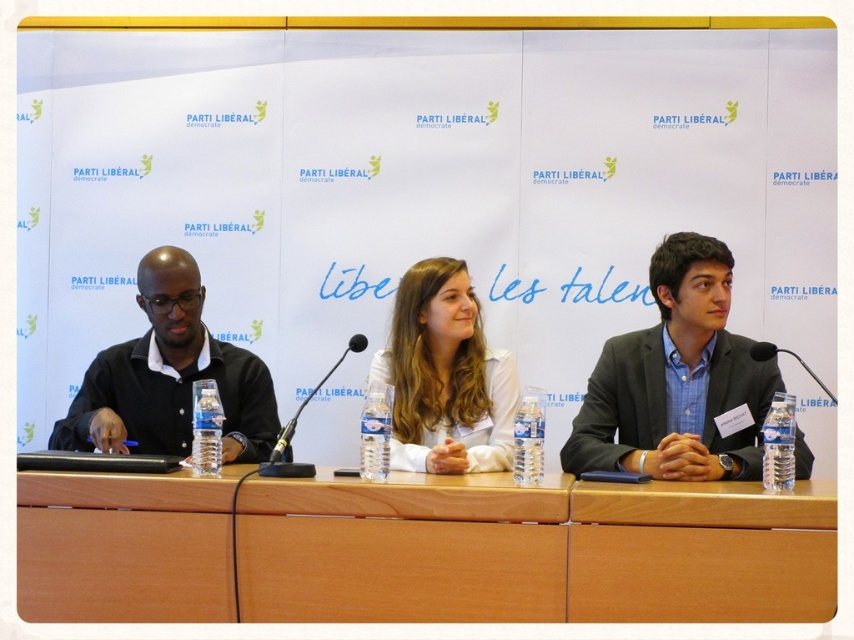
Question: Is light brown wood table at center above white matte shirt at center?

Choices:
 (A) no
 (B) yes

Answer: (A)

Question: Does light brown wood table at center appear on the right side of black matte shirt at left?

Choices:
 (A) yes
 (B) no

Answer: (A)

Question: Which object appears closest to the camera in this image?

Choices:
 (A) black plastic microphone at center
 (B) black plastic microphone at right
 (C) white matte shirt at center

Answer: (B)

Question: Does matte black suit at right appear over black plastic microphone at right?

Choices:
 (A) no
 (B) yes

Answer: (B)

Question: Which object is closer to the camera taking this photo?

Choices:
 (A) matte black suit at right
 (B) light brown wood table at center

Answer: (B)

Question: Among these objects, which one is farthest from the camera?

Choices:
 (A) matte black suit at right
 (B) white matte shirt at center
 (C) light brown wood table at center

Answer: (A)